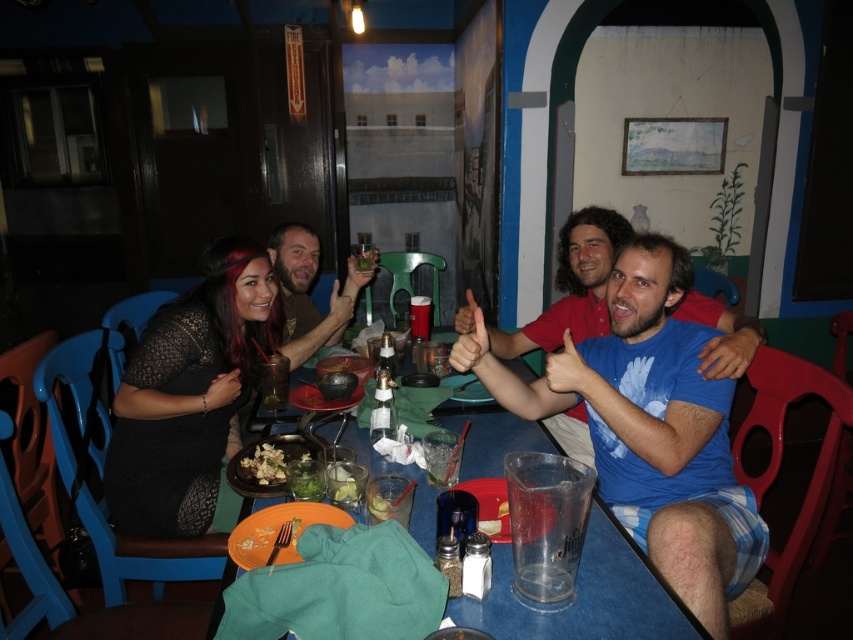
Question: Which object is positioned closest to the blue cotton shirt at center?

Choices:
 (A) green leafy salad at center
 (B) blue plastic table at center

Answer: (B)

Question: Is black lace dress at left bigger than blue plastic table at center?

Choices:
 (A) yes
 (B) no

Answer: (A)

Question: Is blue cotton shirt at center thinner than white crumbly food at center?

Choices:
 (A) yes
 (B) no

Answer: (B)

Question: Does matte brown hair at center appear over matte plastic cup at center?

Choices:
 (A) no
 (B) yes

Answer: (B)

Question: Which point is farther to the camera?

Choices:
 (A) matte brown hair at center
 (B) blue plastic table at center

Answer: (A)

Question: Which of the following is the closest to the observer?

Choices:
 (A) [x=517, y=608]
 (B) [x=169, y=364]

Answer: (A)